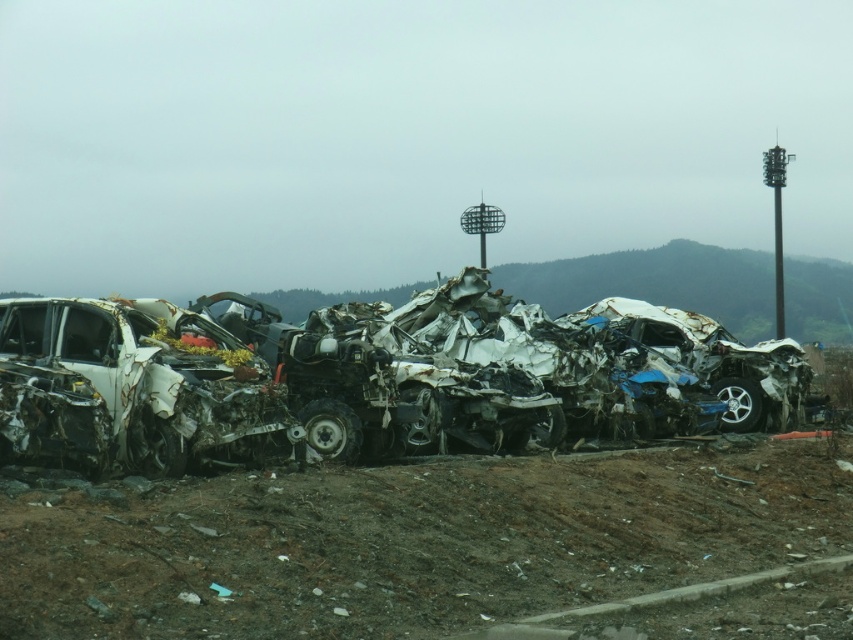
Does rusty metal wreck at center appear on the right side of rusty metal car at left?

Yes, rusty metal wreck at center is to the right of rusty metal car at left.

Can you confirm if rusty metal wreck at center is wider than rusty metal car at left?

Yes.

Image resolution: width=853 pixels, height=640 pixels. What do you see at coordinates (521, 365) in the screenshot? I see `rusty metal wreck at center` at bounding box center [521, 365].

This screenshot has height=640, width=853. I want to click on rusty metal wreck at center, so click(521, 365).